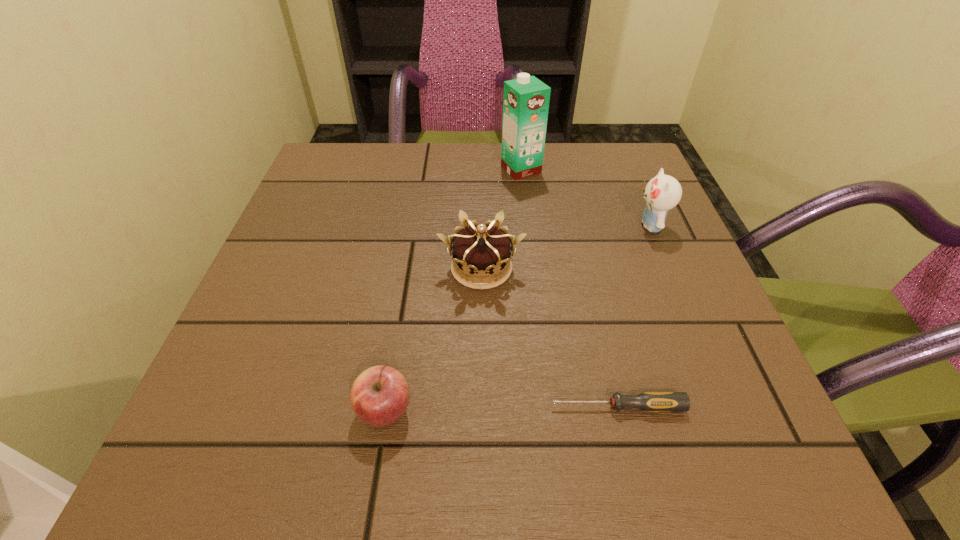
Identify the location of free spot between the leftmost object and the tallest object. This screenshot has width=960, height=540. (453, 290).

At what (x,y) coordinates should I click in order to perform the action: click on vacant area that lies between the rightmost object and the farthest object. Please return your answer as a coordinate pair (x, y). The image size is (960, 540). Looking at the image, I should click on (586, 197).

The width and height of the screenshot is (960, 540). Identify the location of free space between the screwdriver and the rightmost object. (634, 316).

Where is `free space that is in between the screwdriver and the crown`? free space that is in between the screwdriver and the crown is located at coordinates (549, 338).

This screenshot has width=960, height=540. Identify the location of blank region between the farthest object and the kitten. (586, 197).

The height and width of the screenshot is (540, 960). I want to click on free area in between the leftmost object and the kitten, so click(517, 318).

Select which object is the second closest to the farthest object. Please provide its 2D coordinates. Your answer should be formatted as a tuple, i.e. [(x, y)], where the tuple contains the x and y coordinates of a point satisfying the conditions above.

[(481, 250)]

The image size is (960, 540). Find the location of `the closest object to the shortest object`. the closest object to the shortest object is located at coordinates (379, 396).